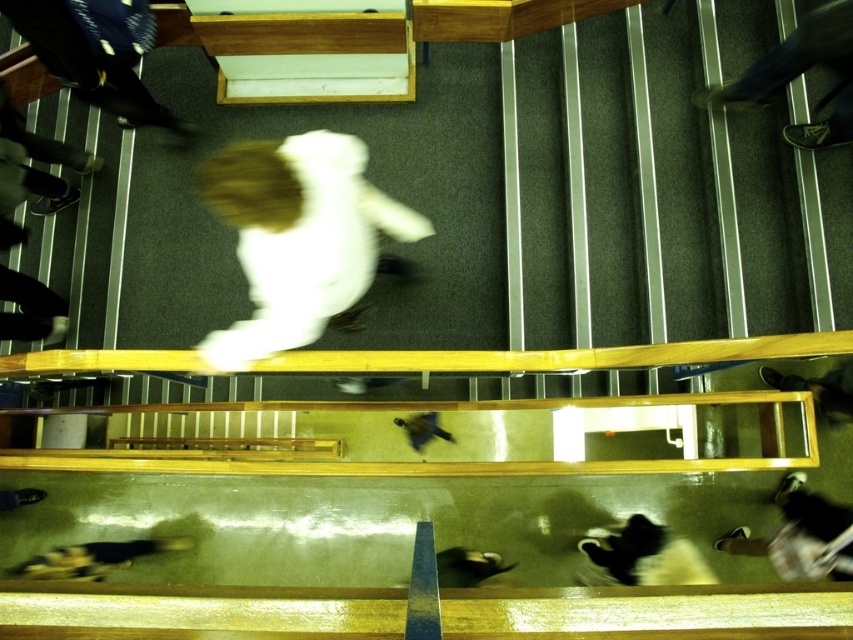
Is dark blue jeans at upper left taller than black fur dog at lower left?

Yes, dark blue jeans at upper left is taller than black fur dog at lower left.

Does point (82, 96) come closer to viewer compared to point (97, 566)?

Yes, point (82, 96) is in front of point (97, 566).

Locate an element on the screen. The height and width of the screenshot is (640, 853). dark blue jeans at upper left is located at coordinates (88, 64).

Does dark blue jeans at upper right appear on the right side of dark brown leather shoes at lower right?

In fact, dark blue jeans at upper right is to the left of dark brown leather shoes at lower right.

Does dark blue jeans at upper right appear under dark brown leather shoes at lower right?

Actually, dark blue jeans at upper right is above dark brown leather shoes at lower right.

Is point (764, 99) closer to viewer compared to point (786, 381)?

Yes, point (764, 99) is in front of point (786, 381).

Locate an element on the screen. Image resolution: width=853 pixels, height=640 pixels. dark blue jeans at upper right is located at coordinates (801, 74).

Is white fluffy coat at center further to the viewer compared to black fur dog at lower left?

No.

Is point (288, 305) positioned after point (35, 557)?

That is False.

Find the location of a particular element. white fluffy coat at center is located at coordinates (297, 236).

Where is `white fluffy coat at center`? white fluffy coat at center is located at coordinates (297, 236).